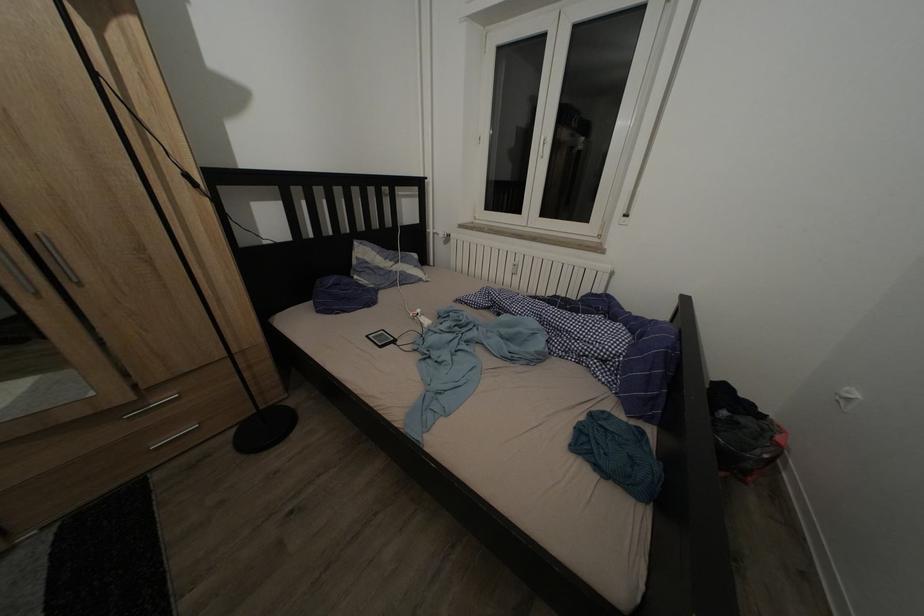
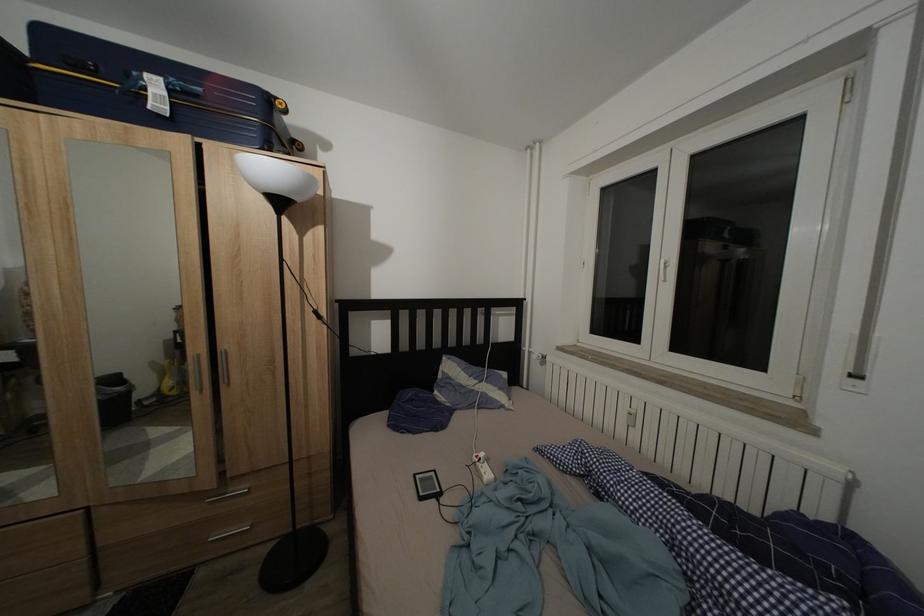
Locate, in the second image, the point that corresponds to pixel 374 342 in the first image.

(422, 482)